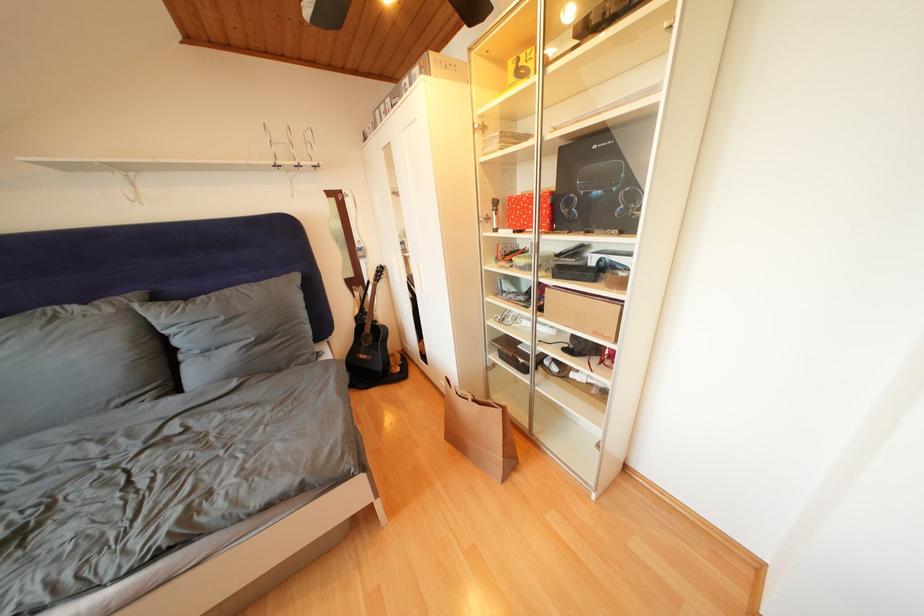
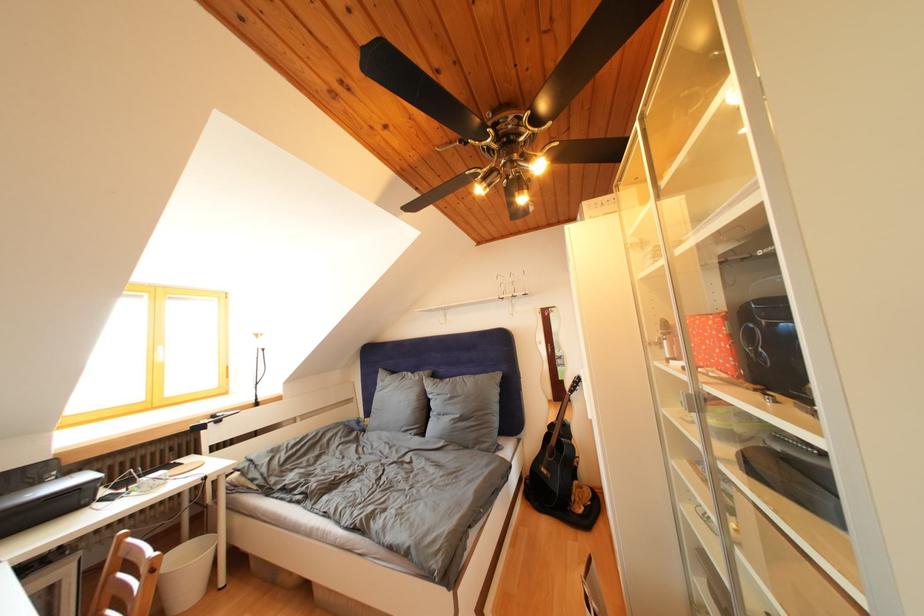
Where in the second image is the point corresponding to pixel 117 315 from the first image?

(426, 383)